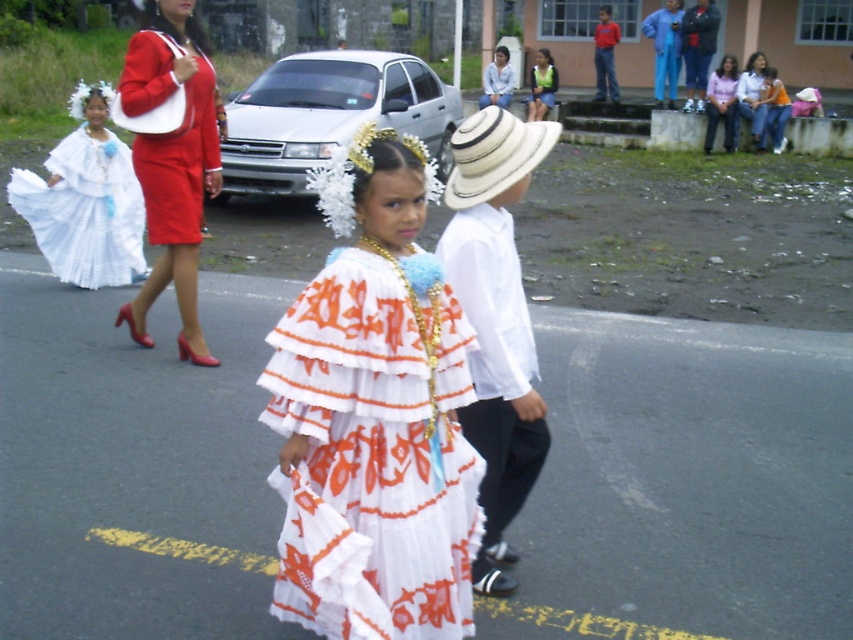
Question: Can you confirm if white cotton shirt at center is positioned above white cotton blouse at upper center?

Choices:
 (A) no
 (B) yes

Answer: (A)

Question: Which object is positioned farthest from the blue fabric pants at upper right?

Choices:
 (A) white cotton dress at left
 (B) matte red dress at left

Answer: (B)

Question: Is white cotton shirt at center thinner than blue fabric pants at upper right?

Choices:
 (A) yes
 (B) no

Answer: (A)

Question: Based on their relative distances, which object is nearer to the blue fabric pants at upper right?

Choices:
 (A) white cotton blouse at upper center
 (B) white pleated dress at center
 (C) white cotton shirt at center
 (D) matte red dress at left

Answer: (A)

Question: Estimate the real-world distances between objects in this image. Which object is closer to the white cotton dress at left?

Choices:
 (A) white straw hat at center
 (B) white cotton blouse at upper center
 (C) white pleated dress at center
 (D) blue fabric pants at upper right

Answer: (A)

Question: Does white cotton shirt at center have a greater width compared to white cotton dress at left?

Choices:
 (A) no
 (B) yes

Answer: (A)